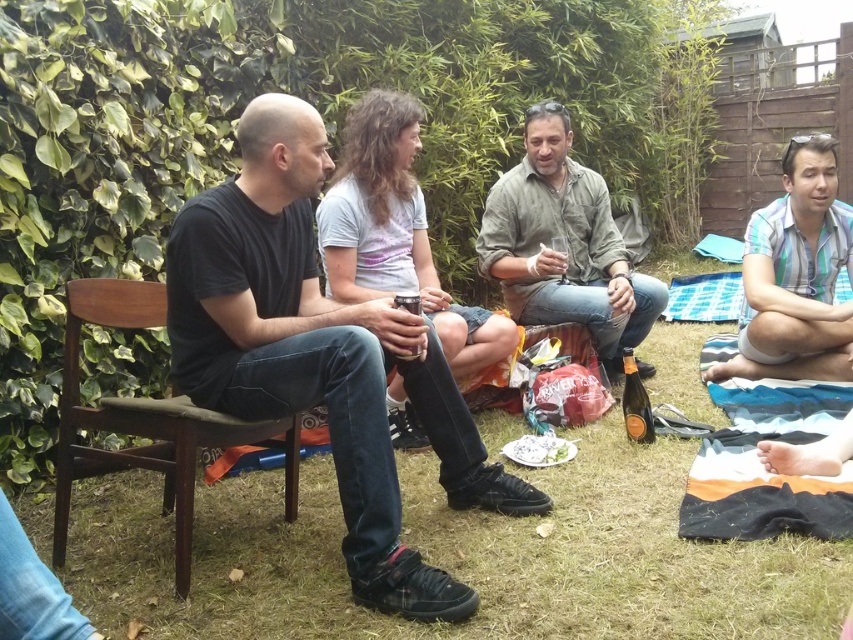
Question: Can you confirm if black matte shirt at left is positioned to the right of striped cotton towel at lower right?

Choices:
 (A) yes
 (B) no

Answer: (B)

Question: Among these points, which one is nearest to the camera?

Choices:
 (A) (223, 212)
 (B) (788, 289)

Answer: (A)

Question: Does rough brown shirt at center appear over blue striped shirt at lower right?

Choices:
 (A) yes
 (B) no

Answer: (A)

Question: Which point is farther from the camera taking this photo?

Choices:
 (A) (85, 500)
 (B) (189, 531)
 (C) (378, 301)
 (D) (531, 152)

Answer: (D)

Question: Does brown wooden chair at left have a larger size compared to striped cotton towel at lower right?

Choices:
 (A) yes
 (B) no

Answer: (B)

Question: Which point is closer to the camera?

Choices:
 (A) green grass at lower left
 (B) brown wooden chair at left
 (C) rough brown shirt at center

Answer: (A)